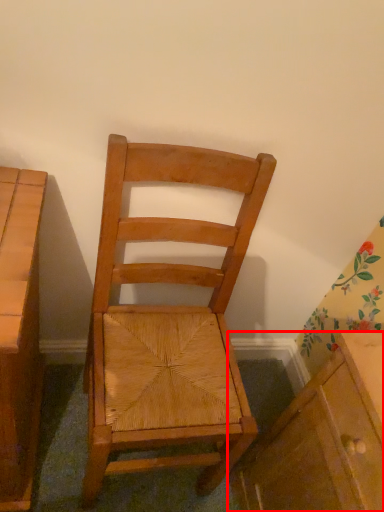
Question: From the image, what is the correct spatial relationship of cabinetry (annotated by the red box) in relation to chair?

Choices:
 (A) left
 (B) right

Answer: (B)